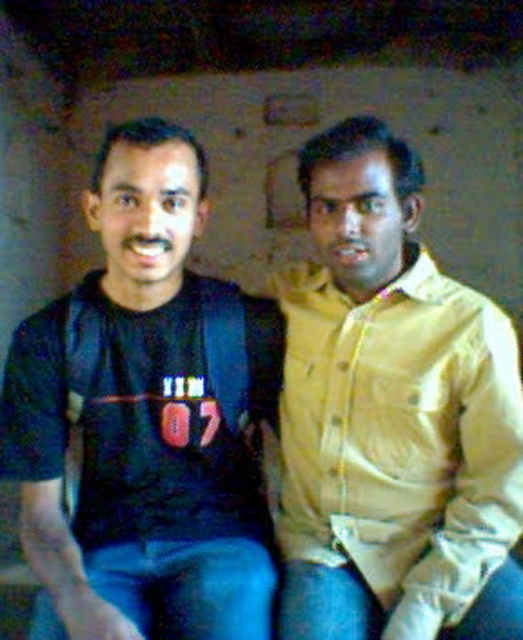
Who is more forward, (86,205) or (404,435)?

Point (404,435)

Does black matte t-shirt at left appear under yellow cotton shirt at right?

Incorrect, black matte t-shirt at left is not positioned below yellow cotton shirt at right.

Is point (140, 476) positioned after point (335, 436)?

Yes, it is.

Identify the location of black matte t-shirt at left. The image size is (523, 640). (145, 419).